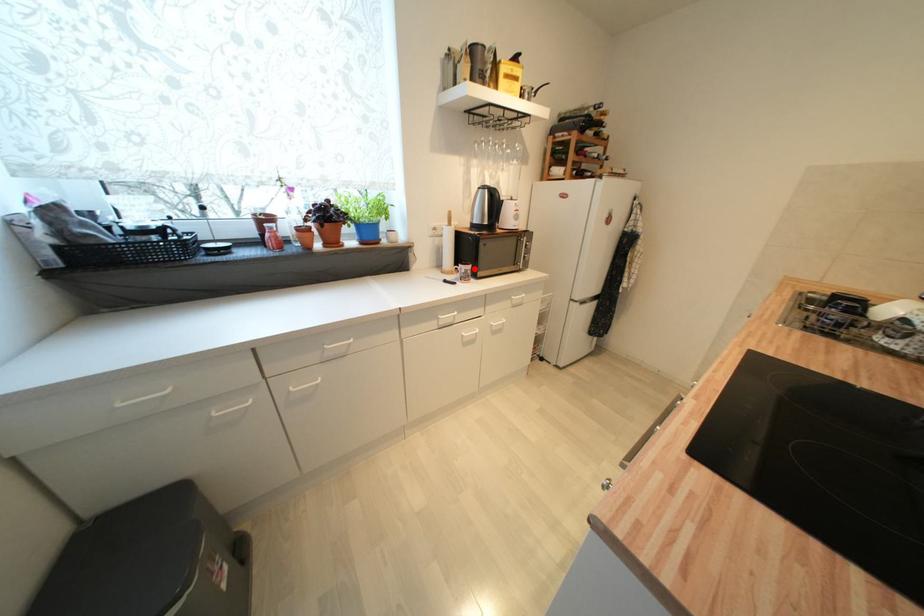
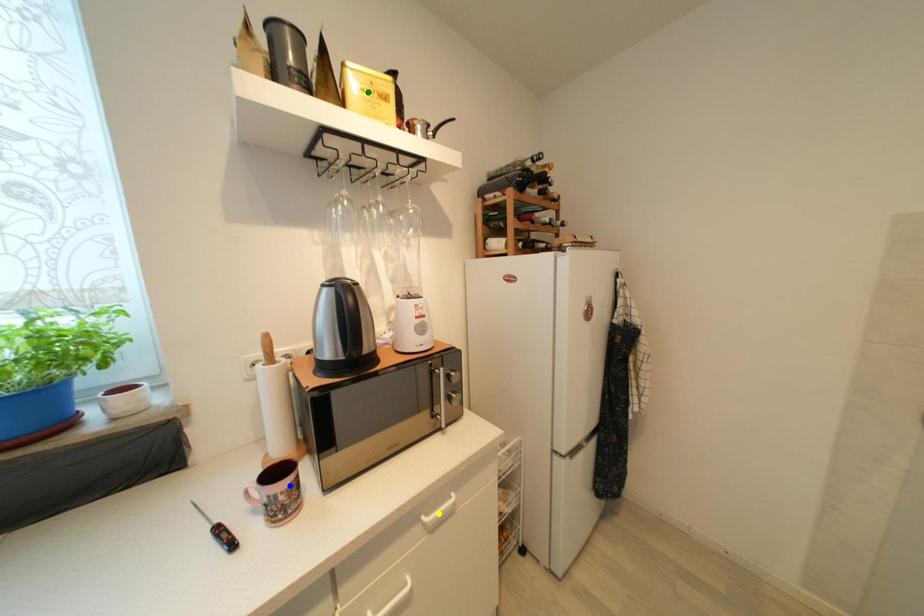
Question: I am providing you with two images of the same scene from different viewpoints. A red point is marked on the first image. You are given multiple points on the second image. Which spot in image 2 lines up with the point in image 1?

Choices:
 (A) blue point
 (B) yellow point
 (C) green point

Answer: (A)